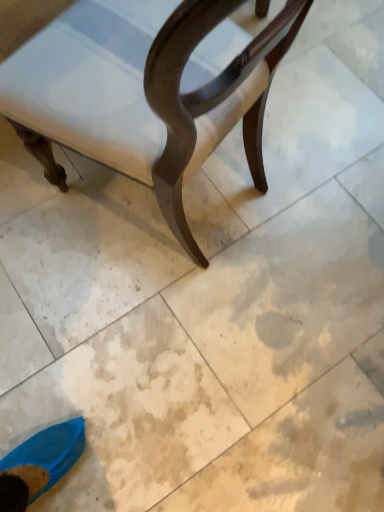
In order to face glossy wood chair at upper center, should I rotate leftwards or rightwards?

Turn left approximately 4.920 degrees to face it.

Locate an element on the screen. Image resolution: width=384 pixels, height=512 pixels. glossy wood chair at upper center is located at coordinates (145, 94).

This screenshot has width=384, height=512. Describe the element at coordinates (145, 94) in the screenshot. I see `glossy wood chair at upper center` at that location.

Identify the location of glossy wood chair at upper center. This screenshot has height=512, width=384. (145, 94).